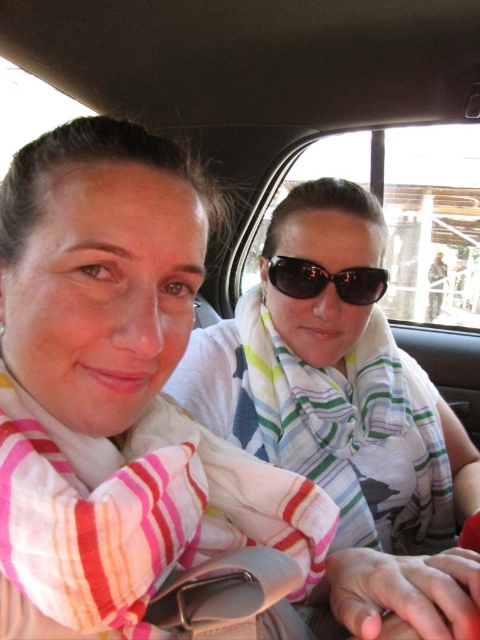
Can you confirm if white striped scarf at center is positioned to the right of matte black sunglasses at center?

In fact, white striped scarf at center is to the left of matte black sunglasses at center.

Which is behind, point (358, 241) or point (369, 301)?

Positioned behind is point (369, 301).

This screenshot has height=640, width=480. I want to click on white striped scarf at center, so click(x=346, y=419).